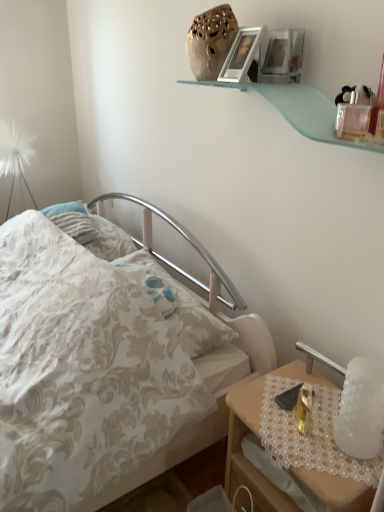
Locate an element on the screen. blank space situated above wooden nightstand at lower right (from a real-world perspective) is located at coordinates (306, 414).